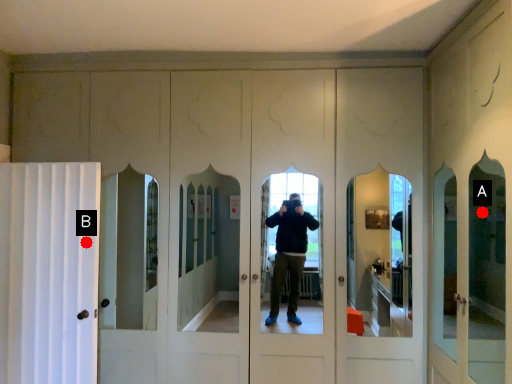
Question: Two points are circled on the image, labeled by A and B beside each circle. Which point appears farthest from the camera in this image?

Choices:
 (A) A is further
 (B) B is further

Answer: (B)